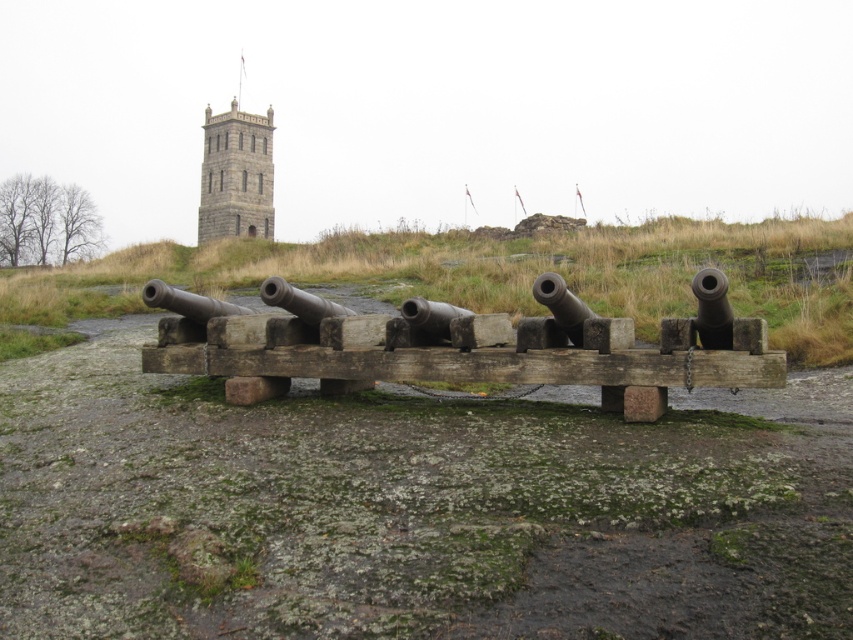
Describe the element at coordinates (236, 173) in the screenshot. The height and width of the screenshot is (640, 853). I see `stone tower at upper center` at that location.

Between stone tower at upper center and brass polished cannon at center, which one appears on the right side from the viewer's perspective?

From the viewer's perspective, brass polished cannon at center appears more on the right side.

You are a GUI agent. You are given a task and a screenshot of the screen. Output one action in this format:
    pyautogui.click(x=<x>, y=<y>)
    Task: Click on the stone tower at upper center
    Image resolution: width=853 pixels, height=640 pixels.
    Given the screenshot: What is the action you would take?
    pyautogui.click(x=236, y=173)

Where is `stone tower at upper center`? The width and height of the screenshot is (853, 640). stone tower at upper center is located at coordinates (236, 173).

What do you see at coordinates (502, 273) in the screenshot? I see `green grassy at center` at bounding box center [502, 273].

Can you confirm if green grassy at center is thinner than brass polished cannon at center?

Incorrect, green grassy at center's width is not less than brass polished cannon at center's.

The image size is (853, 640). Find the location of `green grassy at center`. green grassy at center is located at coordinates (502, 273).

The image size is (853, 640). Find the location of `green grassy at center`. green grassy at center is located at coordinates (502, 273).

Who is positioned more to the right, rusty metal cannon at center or stone tower at upper center?

Positioned to the right is rusty metal cannon at center.

Which is in front, point (283, 381) or point (259, 129)?

Point (283, 381)

Identify the location of rusty metal cannon at center. (466, 346).